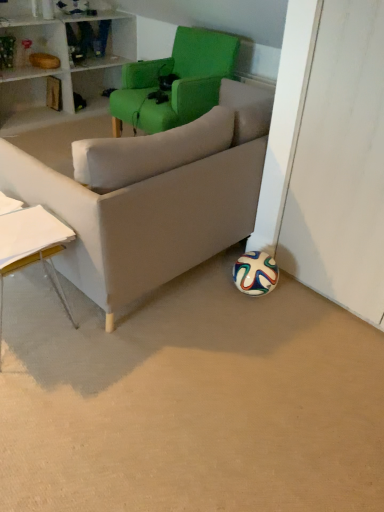
What is the approximate width of green fabric chair at upper center?

green fabric chair at upper center is 29.45 inches in width.

Where is `green fabric chair at upper center`? green fabric chair at upper center is located at coordinates (176, 81).

What do you see at coordinates (176, 81) in the screenshot? I see `green fabric chair at upper center` at bounding box center [176, 81].

Locate an element on the screen. Image resolution: width=384 pixels, height=512 pixels. white paper at left is located at coordinates (30, 243).

The image size is (384, 512). What do you see at coordinates (30, 243) in the screenshot? I see `white paper at left` at bounding box center [30, 243].

This screenshot has height=512, width=384. Find the location of `green fabric chair at upper center`. green fabric chair at upper center is located at coordinates (176, 81).

Considering the relative positions of green fabric chair at upper center and white paper at left in the image provided, is green fabric chair at upper center to the left or to the right of white paper at left?

Clearly, green fabric chair at upper center is on the right of white paper at left in the image.

Does green fabric chair at upper center lie in front of white paper at left?

No, the depth of green fabric chair at upper center is greater than that of white paper at left.

Which is in front, point (197, 48) or point (34, 226)?

Positioned in front is point (34, 226).

From the image's perspective, who appears lower, green fabric chair at upper center or white paper at left?

white paper at left.

From a real-world perspective, is green fabric chair at upper center physically above white paper at left?

Yes, from a real-world perspective, green fabric chair at upper center is over white paper at left

Which object is thinner, green fabric chair at upper center or white paper at left?

Thinner between the two is white paper at left.

Considering the relative sizes of green fabric chair at upper center and white paper at left in the image provided, is green fabric chair at upper center shorter than white paper at left?

Incorrect, the height of green fabric chair at upper center does not fall short of that of white paper at left.

Considering the relative sizes of green fabric chair at upper center and white paper at left in the image provided, is green fabric chair at upper center smaller than white paper at left?

No.

Is green fabric chair at upper center completely or partially outside of white paper at left?

Indeed, green fabric chair at upper center is completely outside white paper at left.

Is green fabric chair at upper center beside white paper at left?

green fabric chair at upper center is not next to white paper at left, and they're not touching.

Is green fabric chair at upper center turned away from white paper at left?

No, green fabric chair at upper center is not facing the opposite direction of white paper at left.

How many degrees apart are the facing directions of green fabric chair at upper center and white paper at left?

green fabric chair at upper center and white paper at left are facing 2.42 degrees away from each other.

This screenshot has height=512, width=384. In order to click on table below the green fabric chair at upper center (from a real-world perspective) in this screenshot , I will do `click(30, 243)`.

Which object is positioned more to the left, white paper at left or green fabric chair at upper center?

white paper at left is more to the left.

Considering the relative positions of white paper at left and green fabric chair at upper center in the image provided, is white paper at left in front of green fabric chair at upper center?

Yes, white paper at left is in front of green fabric chair at upper center.

Does point (0, 256) come behind point (138, 90)?

No.

From the image's perspective, which is above, white paper at left or green fabric chair at upper center?

green fabric chair at upper center appears higher in the image.

From a real-world perspective, between white paper at left and green fabric chair at upper center, who is vertically higher?

green fabric chair at upper center.

Which of these two, white paper at left or green fabric chair at upper center, is thinner?

With smaller width is white paper at left.

In the scene shown: Who is taller, white paper at left or green fabric chair at upper center?

green fabric chair at upper center.

Considering the sizes of objects white paper at left and green fabric chair at upper center in the image provided, who is bigger, white paper at left or green fabric chair at upper center?

green fabric chair at upper center.

Choose the correct answer: Is white paper at left inside green fabric chair at upper center or outside it?

white paper at left is not inside green fabric chair at upper center, it's outside.

Are white paper at left and green fabric chair at upper center far apart?

white paper at left is far away from green fabric chair at upper center.

Does white paper at left turn towards green fabric chair at upper center?

No, white paper at left is not turned towards green fabric chair at upper center.

What's the angular difference between white paper at left and green fabric chair at upper center's facing directions?

There is a 2.42-degree angle between the facing directions of white paper at left and green fabric chair at upper center.

Locate an element on the screen. The width and height of the screenshot is (384, 512). chair that appears above the white paper at left (from the image's perspective) is located at coordinates (176, 81).

The height and width of the screenshot is (512, 384). Find the location of `table on the left of the green fabric chair at upper center`. table on the left of the green fabric chair at upper center is located at coordinates (30, 243).

The width and height of the screenshot is (384, 512). In order to click on table that appears below the green fabric chair at upper center (from a real-world perspective) in this screenshot , I will do `click(30, 243)`.